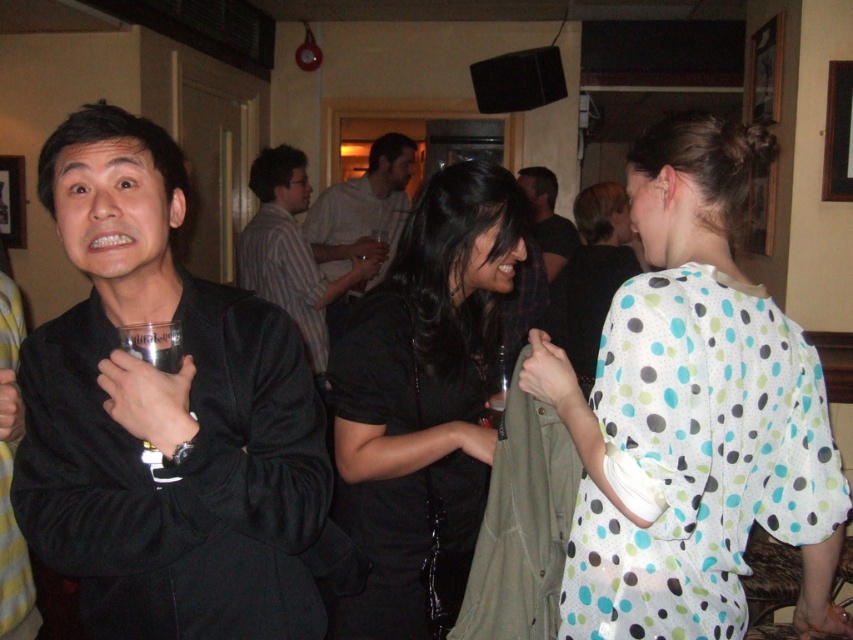
You are organizing a charity event and need to arrange two items displayed in the image for a photo shoot. The items are the black matte jacket at left and the black matte shirt at center. Given their sizes, which item should you place closer to the camera to ensure both are visible in the frame without overlapping?

Since the black matte jacket at left is smaller in size compared to the black matte shirt at center, you should place the black matte jacket at left closer to the camera to ensure both items are visible without overlapping.

You are standing at the entrance of the bar and notice the black matte jacket at left. Based on its position in the image, can you estimate how far it is from the left edge of the room?

The black matte jacket at left is located at point 0.650 on the x and y coordinates, so it is approximately 65.0 centimeters from the left edge of the room.